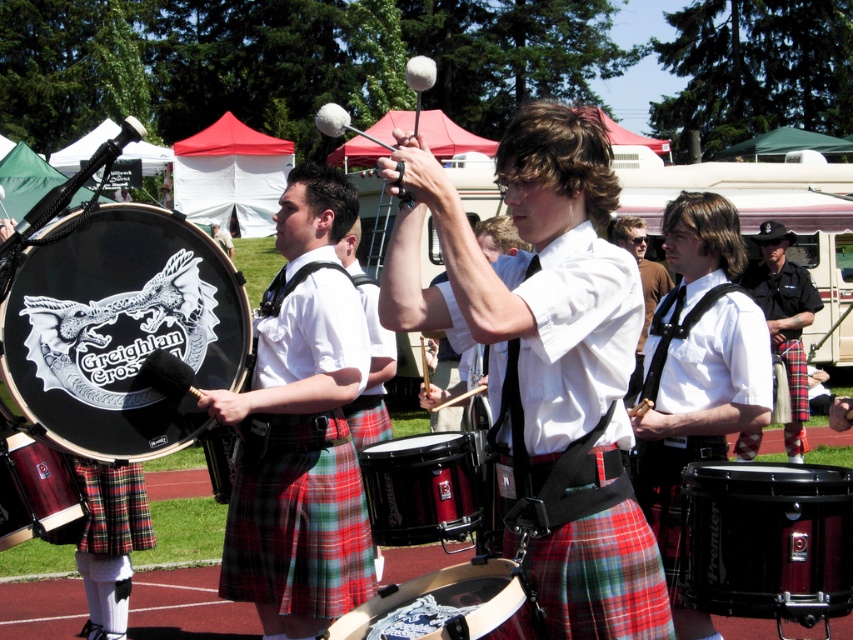
Question: Which point appears closest to the camera in this image?

Choices:
 (A) (444, 458)
 (B) (747, 554)
 (C) (296, 324)
 (D) (531, 637)

Answer: (D)

Question: Is black leather drum at left further to the viewer compared to black polished drum at center?

Choices:
 (A) yes
 (B) no

Answer: (A)

Question: Does shiny silver drum at center appear over wooden drum at center?

Choices:
 (A) no
 (B) yes

Answer: (A)

Question: Which of the following is the farthest from the observer?

Choices:
 (A) (397, 445)
 (B) (634, 227)

Answer: (B)

Question: Among these objects, which one is nearest to the camera?

Choices:
 (A) black polished drum at center
 (B) black leather hat at upper right
 (C) matte black drum at center

Answer: (A)

Question: Is black leather drum at left above plaid kilt at center?

Choices:
 (A) yes
 (B) no

Answer: (B)